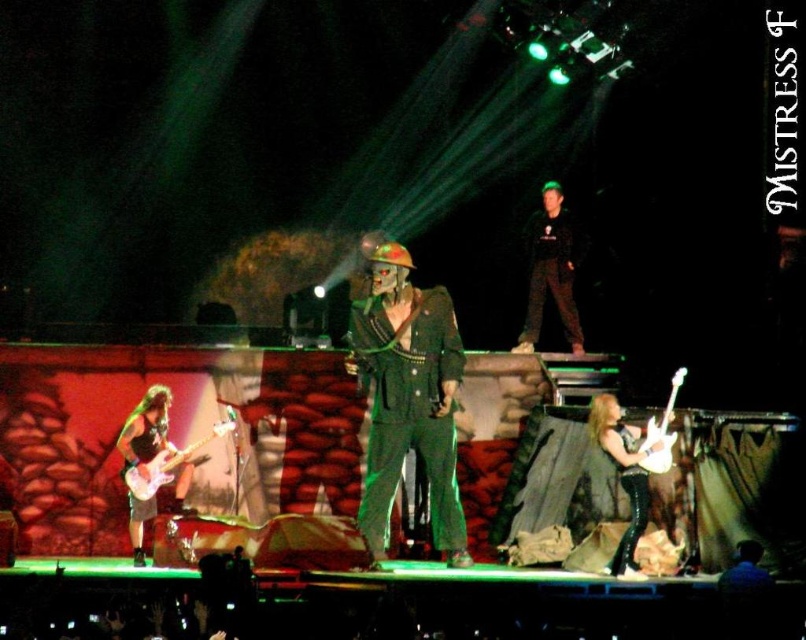
Question: Which of the following is the farthest from the observer?

Choices:
 (A) (135, 476)
 (B) (553, 296)

Answer: (B)

Question: Which object appears closest to the camera in this image?

Choices:
 (A) leather jacket at right
 (B) black matte pants at center
 (C) green matte suit at center
 (D) shiny black guitar at lower left

Answer: (D)

Question: Does leather jacket at right appear on the left side of shiny black guitar at lower left?

Choices:
 (A) yes
 (B) no

Answer: (B)

Question: Does black matte pants at center have a lesser width compared to glossy white electric guitar at lower left?

Choices:
 (A) yes
 (B) no

Answer: (A)

Question: Based on their relative distances, which object is nearer to the shiny black guitar at lower left?

Choices:
 (A) leather jacket at right
 (B) green matte suit at center
 (C) black matte pants at center

Answer: (B)

Question: Can you confirm if green matte suit at center is bigger than black matte pants at center?

Choices:
 (A) yes
 (B) no

Answer: (A)